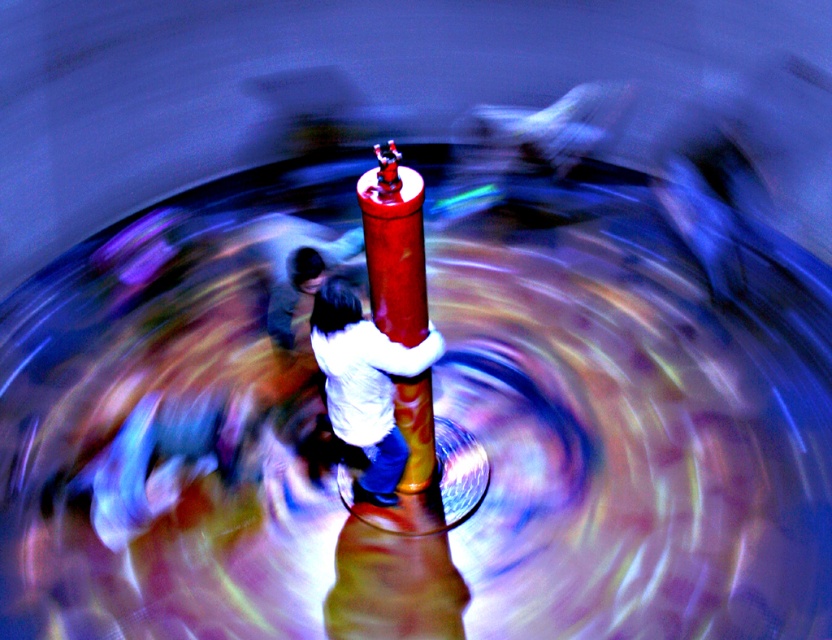
You are standing at the camera position and want to hand a small item to the person wearing the white matte shirt at center. Can you reach them without moving from your current position?

The white matte shirt at center and the camera are 12.76 feet apart from each other, so you cannot reach them without moving from your current position since the distance is too far.

You are a photographer trying to capture the exact position of the white matte shirt at center in the image. According to the coordinates provided, what are the x and y values representing its position?

The white matte shirt at center is located at the 2D coordinates of point 0.600 in the x direction and 0.440 in the y direction.